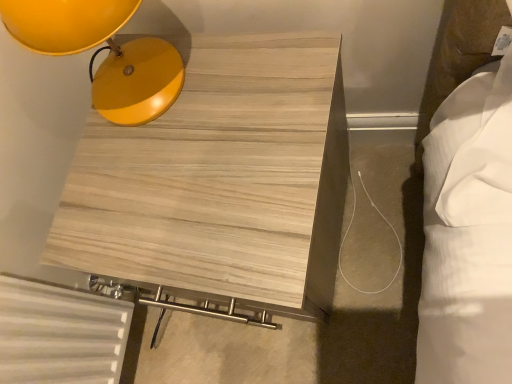
Question: Is matte yellow lampshade at upper left to the left or to the right of light wood/texture side table at upper left in the image?

Choices:
 (A) right
 (B) left

Answer: (B)

Question: In the image, is matte yellow lampshade at upper left positioned in front of or behind light wood/texture side table at upper left?

Choices:
 (A) behind
 (B) front

Answer: (B)

Question: From a real-world perspective, is matte yellow lampshade at upper left positioned above or below light wood/texture side table at upper left?

Choices:
 (A) below
 (B) above

Answer: (B)

Question: Considering the positions of point (214, 193) and point (52, 11), is point (214, 193) closer or farther from the camera than point (52, 11)?

Choices:
 (A) farther
 (B) closer

Answer: (A)

Question: Considering the positions of light wood/texture side table at upper left and matte yellow lampshade at upper left in the image, is light wood/texture side table at upper left wider or thinner than matte yellow lampshade at upper left?

Choices:
 (A) thin
 (B) wide

Answer: (B)

Question: From their relative heights in the image, would you say light wood/texture side table at upper left is taller or shorter than matte yellow lampshade at upper left?

Choices:
 (A) short
 (B) tall

Answer: (B)

Question: Visually, is light wood/texture side table at upper left positioned to the left or to the right of matte yellow lampshade at upper left?

Choices:
 (A) left
 (B) right

Answer: (B)